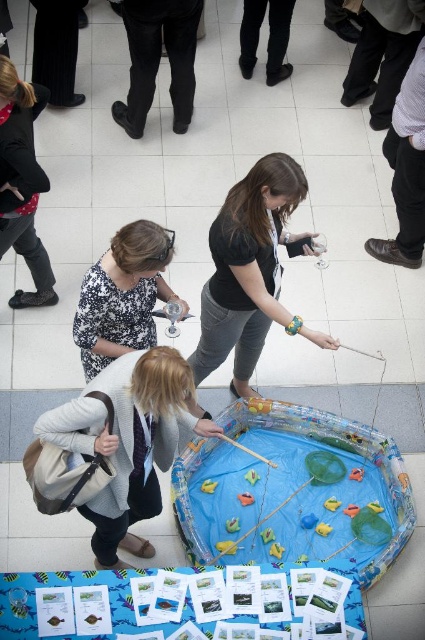
You are standing at the origin point of the coordinate system. You want to move towards the black matte shirt at center located at point (251, 272). What direction should you move in?

You should move towards the point (251, 272) to reach the black matte shirt at center.